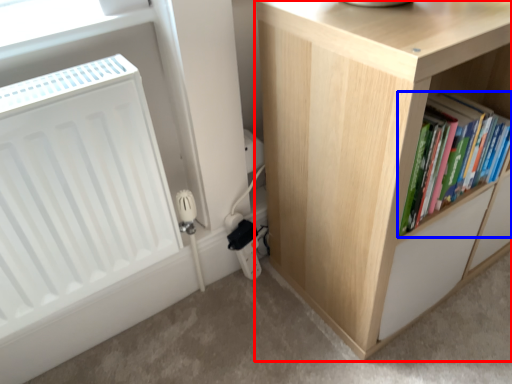
Question: Among these objects, which one is farthest to the camera, cupboard (highlighted by a red box) or book (highlighted by a blue box)?

Choices:
 (A) cupboard
 (B) book

Answer: (B)